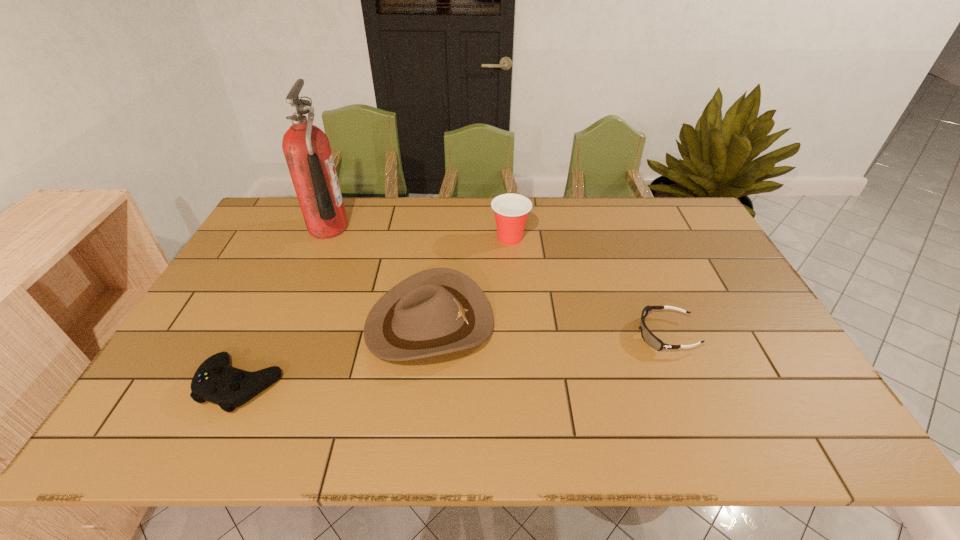
Locate an element on the screen. This screenshot has width=960, height=540. the tallest object is located at coordinates (306, 148).

Identify the location of cup. (511, 210).

Identify the location of cowboy hat. This screenshot has width=960, height=540. (437, 311).

This screenshot has width=960, height=540. Identify the location of the second shortest object. (215, 381).

What are the coordinates of `the rightmost object` in the screenshot? It's located at (648, 337).

Locate an element on the screen. Image resolution: width=960 pixels, height=540 pixels. the shortest object is located at coordinates (648, 337).

In order to click on vacant space located on the front of the fire extinguisher near the operation label in this screenshot , I will do `click(374, 228)`.

The width and height of the screenshot is (960, 540). In order to click on free spot located on the right of the cup in this screenshot , I will do pos(646,238).

This screenshot has width=960, height=540. In order to click on vacant space positioned with a star on the front of the cowboy hat in this screenshot , I will do `click(516, 324)`.

Find the location of `free space located on the right of the fourth tallest object`. free space located on the right of the fourth tallest object is located at coordinates (369, 384).